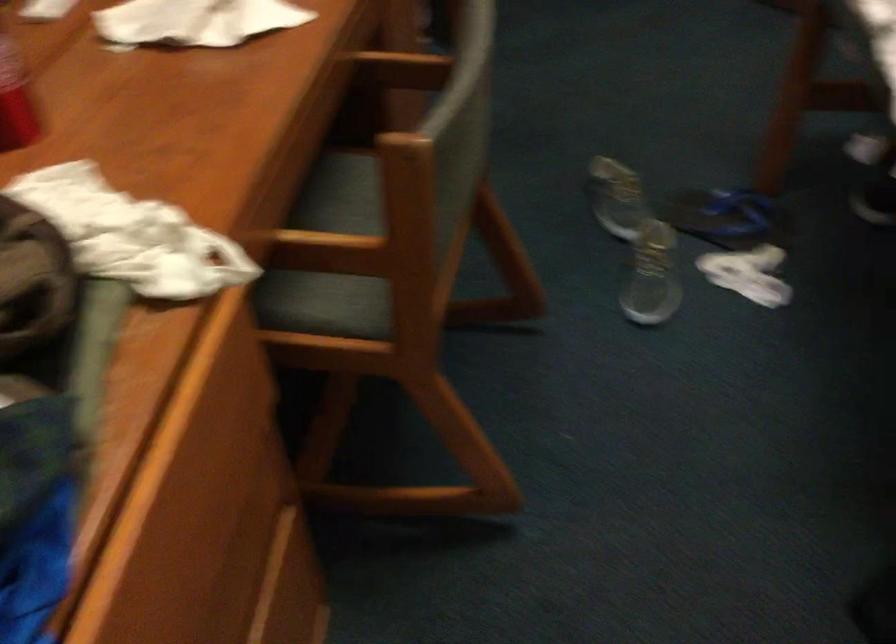
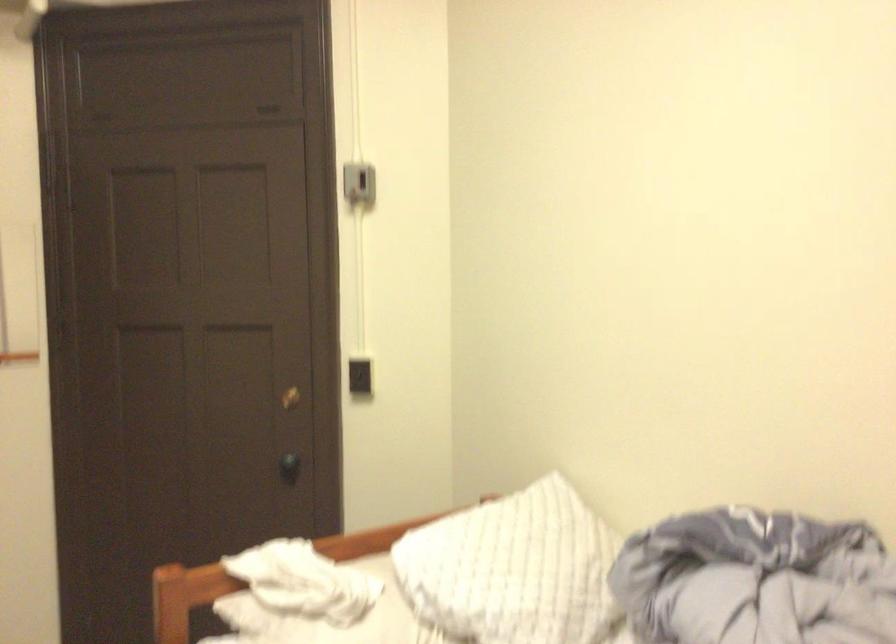
From the picture: First-person continuous shooting, in which direction is the camera rotating?

The camera's rotation is toward right-up.